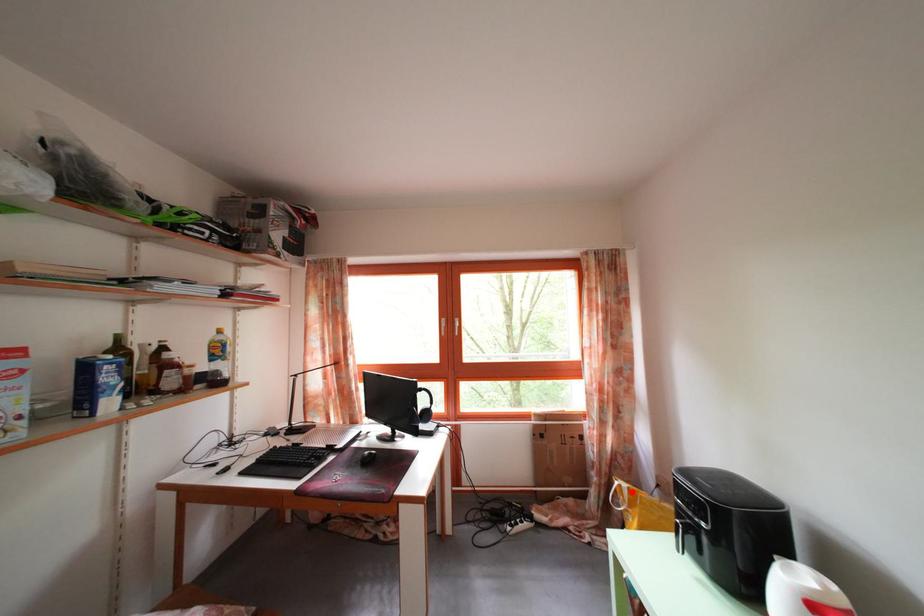
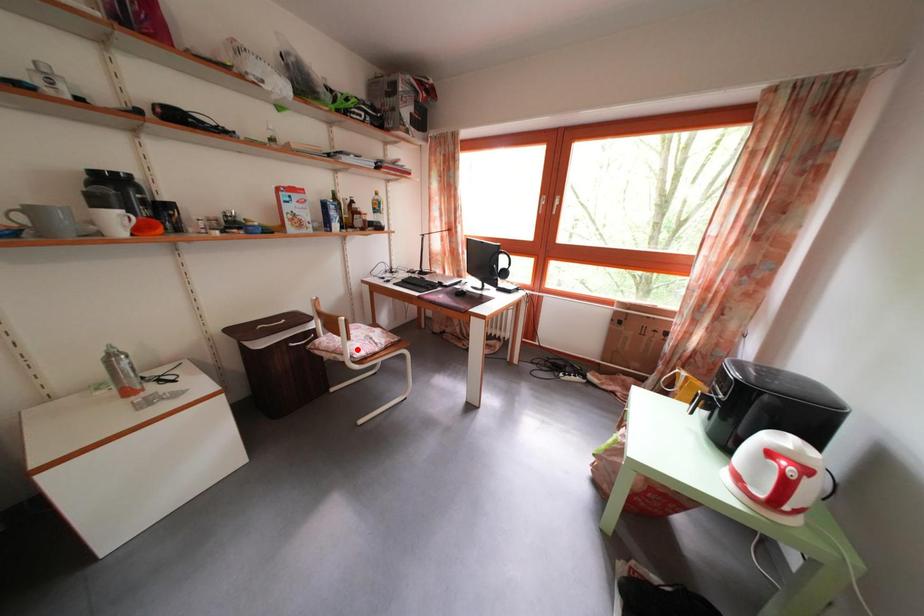
I am providing you with two images of the same scene from different viewpoints. A red point is marked on the first image and another point is marked on the second image. Is the marked point in image1 the same physical position as the marked point in image2?

No